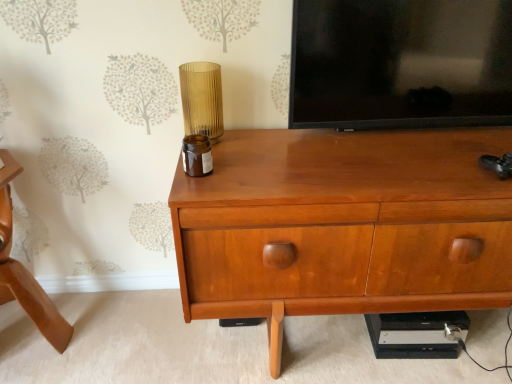
Where is `vacant space underneath black glossy tv at upper center (from a real-world perspective)`? The height and width of the screenshot is (384, 512). vacant space underneath black glossy tv at upper center (from a real-world perspective) is located at coordinates (396, 129).